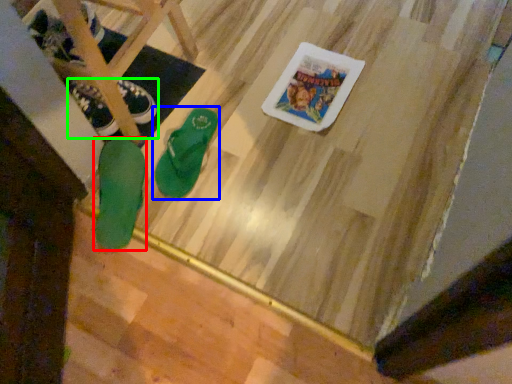
Question: Which is nearer to the footwear (highlighted by a red box)? footwear (highlighted by a blue box) or footwear (highlighted by a green box).

Choices:
 (A) footwear
 (B) footwear

Answer: (A)